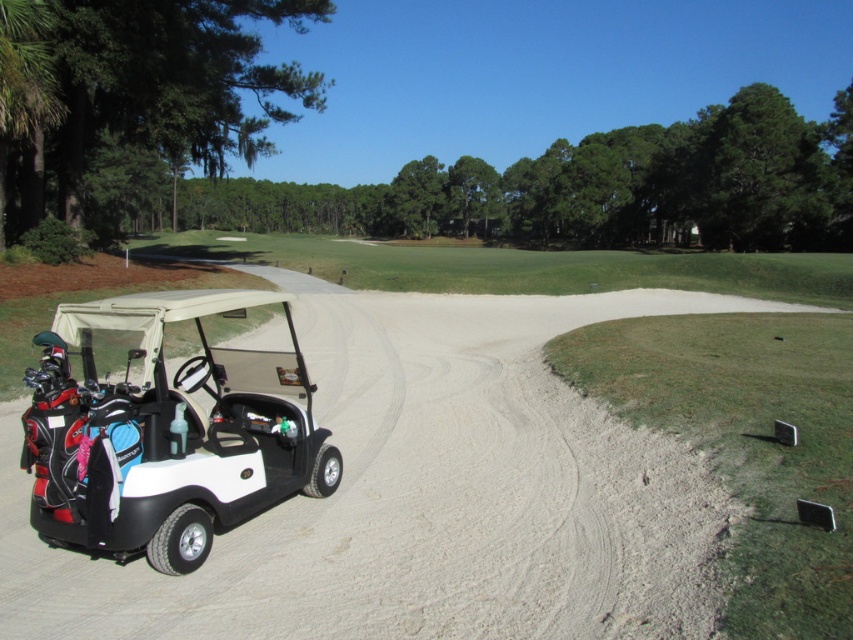
Between point (393, 420) and point (190, 481), which one is positioned in front?

Point (190, 481) is in front.

Between point (619, 536) and point (51, 442), which one is positioned behind?

Positioned behind is point (619, 536).

Image resolution: width=853 pixels, height=640 pixels. Find the location of `white matte golf cart at lower left`. white matte golf cart at lower left is located at coordinates (440, 461).